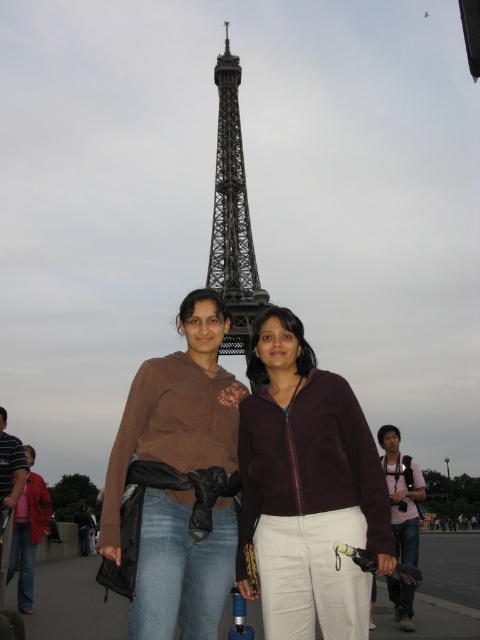
Can you confirm if purple fleece jacket at center is positioned above brushed metal jacket at lower left?

Yes, purple fleece jacket at center is above brushed metal jacket at lower left.

Can you confirm if purple fleece jacket at center is thinner than brushed metal jacket at lower left?

No.

Image resolution: width=480 pixels, height=640 pixels. Find the location of `purple fleece jacket at center`. purple fleece jacket at center is located at coordinates 307,488.

Where is `purple fleece jacket at center`? purple fleece jacket at center is located at coordinates (307, 488).

Who is positioned more to the right, pink fabric bag at center or brushed metal jacket at lower left?

Positioned to the right is pink fabric bag at center.

Is point (418, 550) closer to camera compared to point (17, 522)?

No, (418, 550) is behind (17, 522).

Image resolution: width=480 pixels, height=640 pixels. Find the location of `pink fabric bag at center`. pink fabric bag at center is located at coordinates (402, 493).

Is brown soft hoodie at center below black metal eiffel tower at center?

Indeed, brown soft hoodie at center is positioned under black metal eiffel tower at center.

Measure the distance from brown soft hoodie at center to black metal eiffel tower at center.

brown soft hoodie at center is 102.46 feet from black metal eiffel tower at center.

Find the location of `brown soft hoodie at center`. brown soft hoodie at center is located at coordinates (179, 481).